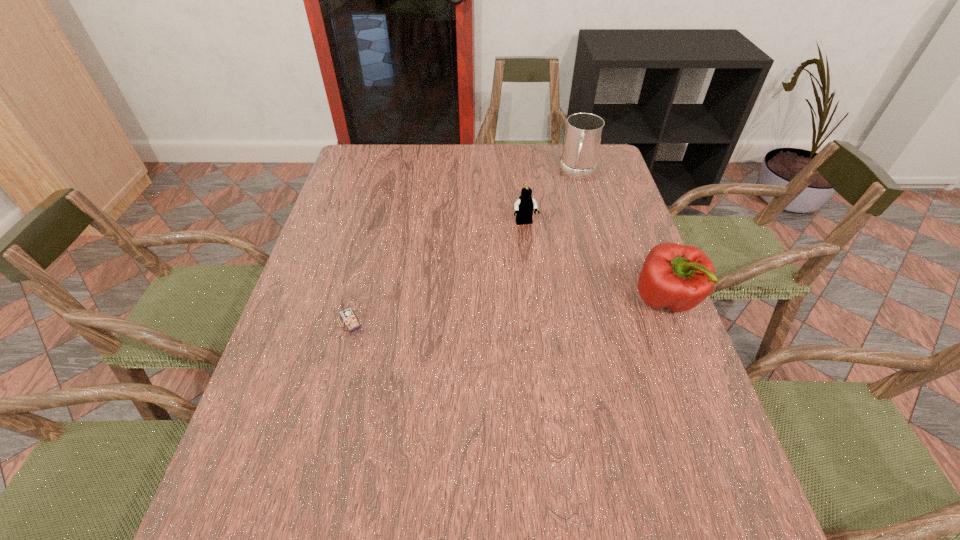
Image resolution: width=960 pixels, height=540 pixels. I want to click on vacant space on the desktop that is between the matchbox and the bell pepper and is positioned on the side of the farthest object with the handle, so click(545, 308).

Where is `free space on the desktop that is between the matchbox and the bell pepper and is positioned on the front-facing side of the Lego`? This screenshot has width=960, height=540. free space on the desktop that is between the matchbox and the bell pepper and is positioned on the front-facing side of the Lego is located at coordinates (556, 307).